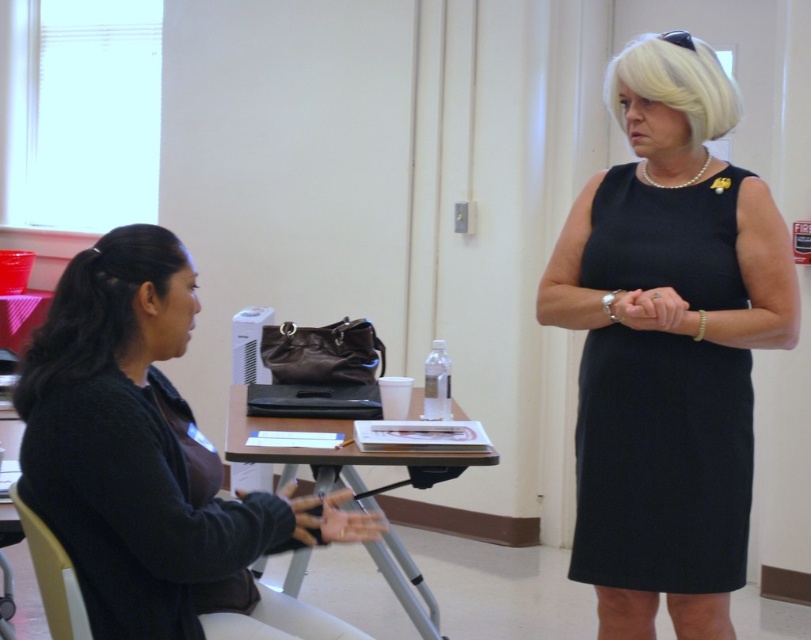
Who is positioned more to the left, dark gray sweater at left or white plastic chair at lower left?

white plastic chair at lower left is more to the left.

Does dark gray sweater at left appear over white plastic chair at lower left?

Indeed, dark gray sweater at left is positioned over white plastic chair at lower left.

Between point (88, 548) and point (35, 560), which one is positioned in front?

Point (88, 548)

This screenshot has height=640, width=811. Identify the location of dark gray sweater at left. (152, 461).

This screenshot has height=640, width=811. I want to click on dark gray sweater at left, so (152, 461).

Who is higher up, dark gray sweater at left or black hair at left?

black hair at left

Between point (132, 548) and point (84, 304), which one is positioned in front?

Point (132, 548) is more forward.

Where is `dark gray sweater at left`? dark gray sweater at left is located at coordinates (152, 461).

Consider the image. Which is above, black fabric dress at center or matte black table at center?

black fabric dress at center

Can you confirm if black fabric dress at center is positioned to the left of matte black table at center?

Incorrect, black fabric dress at center is not on the left side of matte black table at center.

Is point (634, 214) positioned behind point (402, 452)?

No, it is in front of (402, 452).

This screenshot has height=640, width=811. In order to click on black fabric dress at center in this screenshot , I will do `click(661, 461)`.